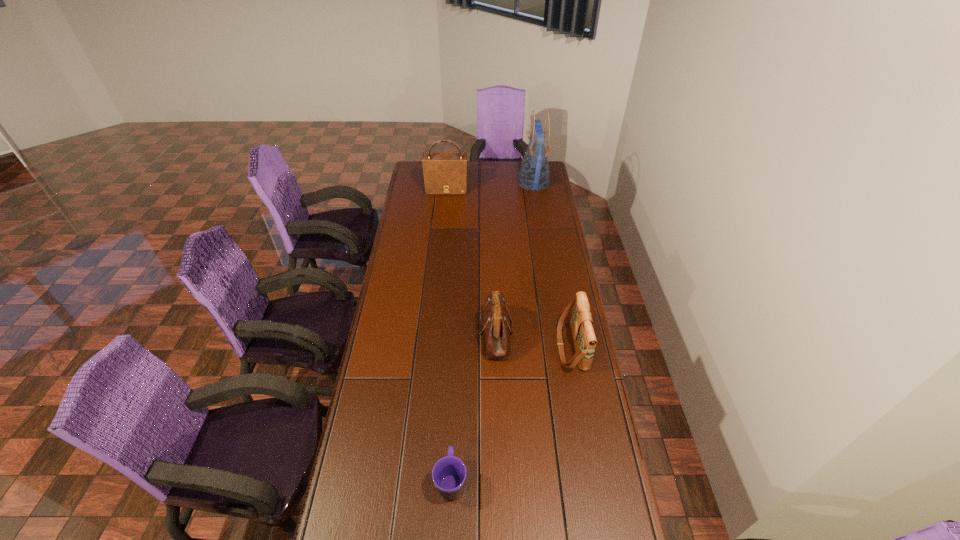
You are a GUI agent. You are given a task and a screenshot of the screen. Output one action in this format:
    pyautogui.click(x=<x>, y=<y>)
    Task: Click on the free point located on the front-facing side of the rightmost shoulder bag
    This screenshot has width=960, height=540.
    Given the screenshot: What is the action you would take?
    pyautogui.click(x=502, y=346)

This screenshot has height=540, width=960. I want to click on vacant area situated on the front-facing side of the rightmost shoulder bag, so click(x=474, y=346).

You are a GUI agent. You are given a task and a screenshot of the screen. Output one action in this format:
    pyautogui.click(x=<x>, y=<y>)
    Task: Click on the blank space located on the front-facing side of the rightmost shoulder bag
    This screenshot has width=960, height=540.
    Given the screenshot: What is the action you would take?
    pyautogui.click(x=508, y=346)

Identify the location of vacant region located 0.260m with the handle on the side of the shortest object. Image resolution: width=960 pixels, height=540 pixels. (456, 382).

Identify the location of free spot located with the handle on the side of the shortest object. (456, 367).

Find the location of a particular element. The image size is (960, 540). free point located 0.140m with the handle on the side of the shortest object is located at coordinates (454, 415).

Identify the location of shopping bag at the far edge. (534, 174).

I want to click on shoulder bag that is positioned at the far edge, so click(444, 173).

This screenshot has width=960, height=540. I want to click on object present at the left edge, so click(x=444, y=173).

Find the location of a particular element. Image resolution: width=960 pixels, height=540 pixels. shopping bag that is at the right edge is located at coordinates (534, 174).